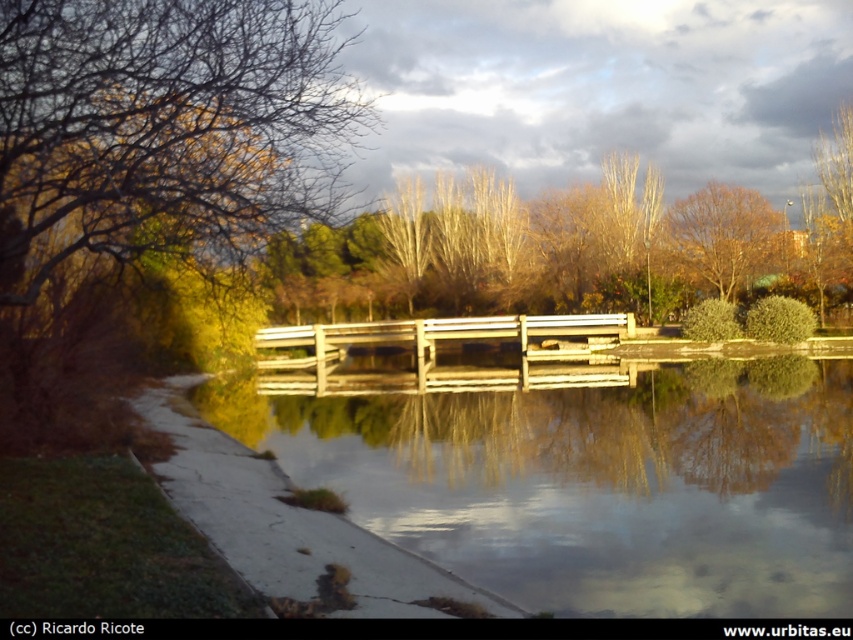
Question: Is transparent water at bridge center to the right of brown matte tree at upper center from the viewer's perspective?

Choices:
 (A) no
 (B) yes

Answer: (A)

Question: Which point appears closest to the camera in this image?

Choices:
 (A) (726, 269)
 (B) (520, 381)

Answer: (B)

Question: Can you confirm if wooden bridge at center is positioned above brown matte tree at upper center?

Choices:
 (A) yes
 (B) no

Answer: (B)

Question: Does transparent water at bridge center appear under brown matte tree at upper center?

Choices:
 (A) no
 (B) yes

Answer: (B)

Question: Which point is closer to the camera?

Choices:
 (A) brown matte tree at upper center
 (B) wooden bridge at center
 (C) transparent water at bridge center

Answer: (C)

Question: Which point is closer to the camera taking this photo?

Choices:
 (A) (730, 227)
 (B) (556, 378)

Answer: (B)